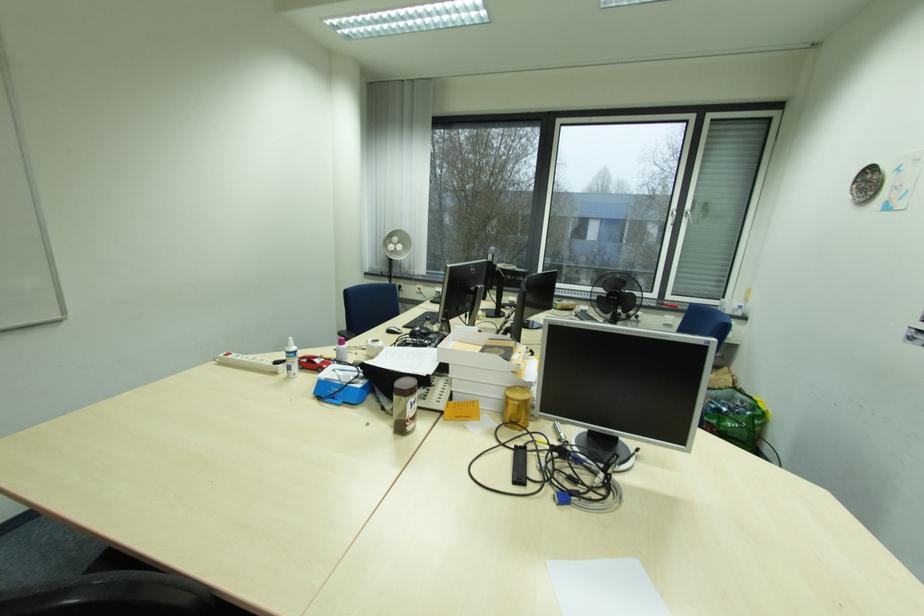
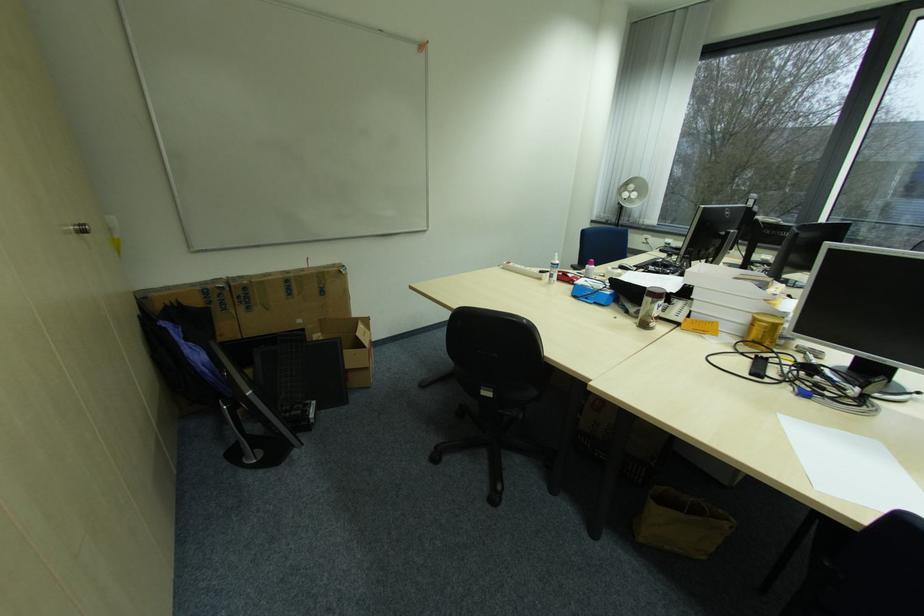
In the second image, find the point that corresponds to (526,406) in the first image.

(773, 329)